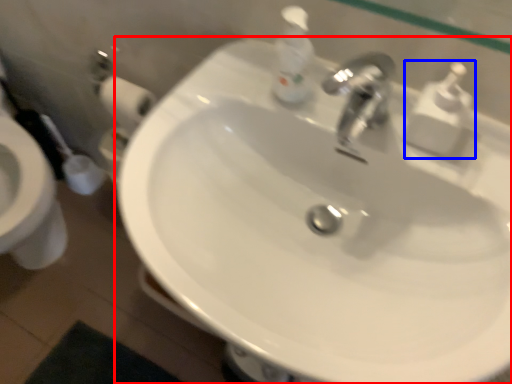
Question: Among these objects, which one is farthest to the camera, sink (highlighted by a red box) or soap dispenser (highlighted by a blue box)?

Choices:
 (A) sink
 (B) soap dispenser

Answer: (B)